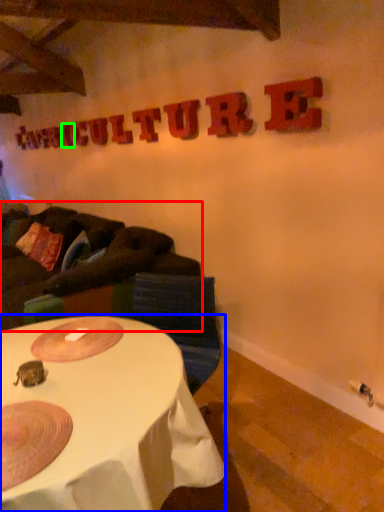
Question: Based on their relative distances, which object is farther from studio couch (highlighted by a red box)? Choose from table (highlighted by a blue box) and letter (highlighted by a green box).

Choices:
 (A) table
 (B) letter

Answer: (B)